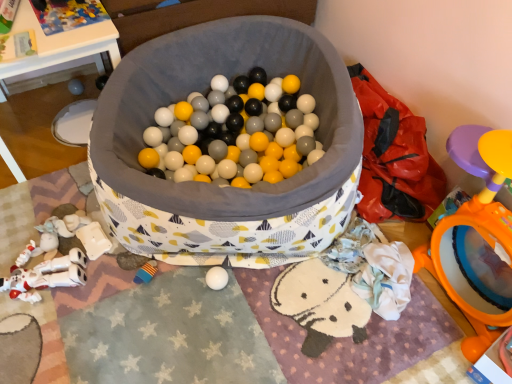
Question: From the image's perspective, is soft plush toy at lower left, positioned as the 5th toy in top-to-bottom order, beneath orange plastic mirror at right, arranged as the 3th toy when ordered from the bottom?

Choices:
 (A) no
 (B) yes

Answer: (B)

Question: Does soft plush toy at lower left, the third toy in the front-to-back sequence, have a greater width compared to orange plastic mirror at right, which is counted as the fifth toy, starting from the left?

Choices:
 (A) no
 (B) yes

Answer: (A)

Question: Is soft plush toy at lower left, positioned as the 5th toy in top-to-bottom order, taller than orange plastic mirror at right, arranged as the fifth toy when viewed from the back?

Choices:
 (A) yes
 (B) no

Answer: (B)

Question: Can we say soft plush toy at lower left, positioned as the 5th toy in top-to-bottom order, lies outside orange plastic mirror at right, acting as the 3th toy starting from the top?

Choices:
 (A) yes
 (B) no

Answer: (A)

Question: Is the position of soft plush toy at lower left, the third toy in the front-to-back sequence, more distant than that of orange plastic mirror at right, the first toy from the right?

Choices:
 (A) yes
 (B) no

Answer: (A)

Question: Is soft plush toy at lower left, the third toy viewed from the back, placed right next to orange plastic mirror at right, acting as the 3th toy starting from the top?

Choices:
 (A) yes
 (B) no

Answer: (B)

Question: Is plastic colorful puzzle pieces at upper left, placed as the 3th toy when sorted from left to right, looking in the opposite direction of fabric-lined ball pit at center?

Choices:
 (A) yes
 (B) no

Answer: (B)

Question: Are plastic colorful puzzle pieces at upper left, marked as the fifth toy in a bottom-to-top arrangement, and fabric-lined ball pit at center located far from each other?

Choices:
 (A) yes
 (B) no

Answer: (B)

Question: Considering the relative sizes of plastic colorful puzzle pieces at upper left, acting as the second toy starting from the back, and fabric-lined ball pit at center in the image provided, is plastic colorful puzzle pieces at upper left, acting as the second toy starting from the back, taller than fabric-lined ball pit at center?

Choices:
 (A) no
 (B) yes

Answer: (A)

Question: From a real-world perspective, is plastic colorful puzzle pieces at upper left, the first toy in the top-to-bottom sequence, beneath fabric-lined ball pit at center?

Choices:
 (A) no
 (B) yes

Answer: (A)

Question: Does plastic colorful puzzle pieces at upper left, which is counted as the fourth toy, starting from the front, have a larger size compared to fabric-lined ball pit at center?

Choices:
 (A) no
 (B) yes

Answer: (A)

Question: Is plastic colorful puzzle pieces at upper left, marked as the fifth toy in a bottom-to-top arrangement, in contact with fabric-lined ball pit at center?

Choices:
 (A) yes
 (B) no

Answer: (B)

Question: Can you confirm if fabric-lined ball pit at center is wider than plastic colorful puzzle pieces at upper left, which is counted as the fourth toy, starting from the front?

Choices:
 (A) no
 (B) yes

Answer: (B)